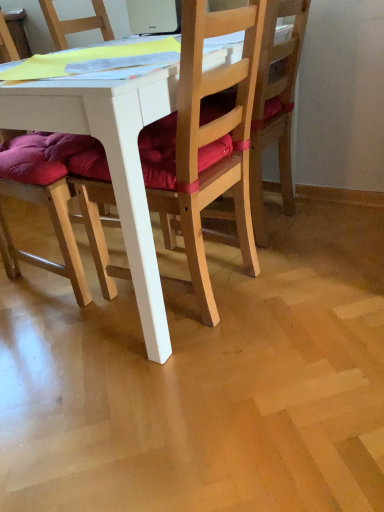
Question: Should I look upward or downward to see purple cushioned chair at left, arranged as the first chair when viewed from the left?

Choices:
 (A) down
 (B) up

Answer: (B)

Question: Are purple cushioned chair at left, arranged as the first chair when viewed from the left, and wooden chair at center, which is the 3th chair in left-to-right order, located far from each other?

Choices:
 (A) no
 (B) yes

Answer: (A)

Question: From a real-world perspective, is purple cushioned chair at left, marked as the 3th chair in a right-to-left arrangement, located higher than wooden chair at center, the 1th chair from the right?

Choices:
 (A) no
 (B) yes

Answer: (B)

Question: Is purple cushioned chair at left, arranged as the first chair when viewed from the left, aimed at wooden chair at center, which is the 3th chair in left-to-right order?

Choices:
 (A) yes
 (B) no

Answer: (B)

Question: Can you confirm if purple cushioned chair at left, arranged as the first chair when viewed from the left, is smaller than wooden chair at center, the 1th chair from the right?

Choices:
 (A) yes
 (B) no

Answer: (B)

Question: Is purple cushioned chair at left, arranged as the first chair when viewed from the left, outside wooden chair at center, which is the 3th chair in left-to-right order?

Choices:
 (A) yes
 (B) no

Answer: (A)

Question: Is purple cushioned chair at left, arranged as the first chair when viewed from the left, shorter than wooden chair at center, the 1th chair from the right?

Choices:
 (A) no
 (B) yes

Answer: (A)

Question: Is wooden chair at center, which appears as the second chair when viewed from the right, bigger than purple cushioned chair at left, marked as the 3th chair in a right-to-left arrangement?

Choices:
 (A) yes
 (B) no

Answer: (A)

Question: From the image's perspective, is wooden chair at center, positioned as the second chair in left-to-right order, on purple cushioned chair at left, marked as the 3th chair in a right-to-left arrangement?

Choices:
 (A) yes
 (B) no

Answer: (B)

Question: Is wooden chair at center, positioned as the second chair in left-to-right order, turned away from purple cushioned chair at left, marked as the 3th chair in a right-to-left arrangement?

Choices:
 (A) no
 (B) yes

Answer: (A)

Question: Is wooden chair at center, which appears as the second chair when viewed from the right, placed right next to purple cushioned chair at left, marked as the 3th chair in a right-to-left arrangement?

Choices:
 (A) no
 (B) yes

Answer: (A)

Question: Can you confirm if wooden chair at center, which appears as the second chair when viewed from the right, is shorter than purple cushioned chair at left, arranged as the first chair when viewed from the left?

Choices:
 (A) no
 (B) yes

Answer: (A)

Question: From the image's perspective, is wooden chair at center, positioned as the second chair in left-to-right order, below purple cushioned chair at left, arranged as the first chair when viewed from the left?

Choices:
 (A) yes
 (B) no

Answer: (A)

Question: From the image's perspective, is white plastic laptop at upper center above purple cushioned chair at left, arranged as the first chair when viewed from the left?

Choices:
 (A) no
 (B) yes

Answer: (B)